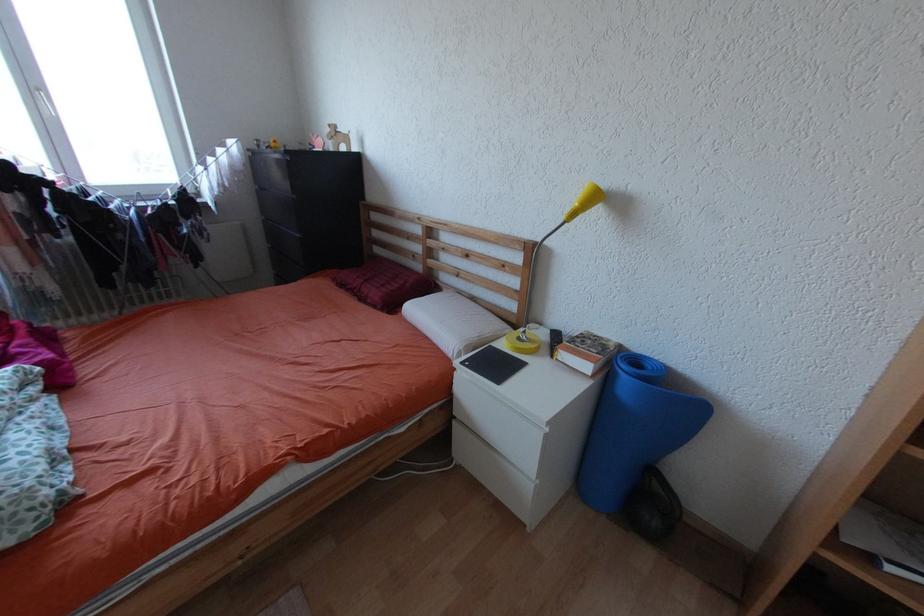
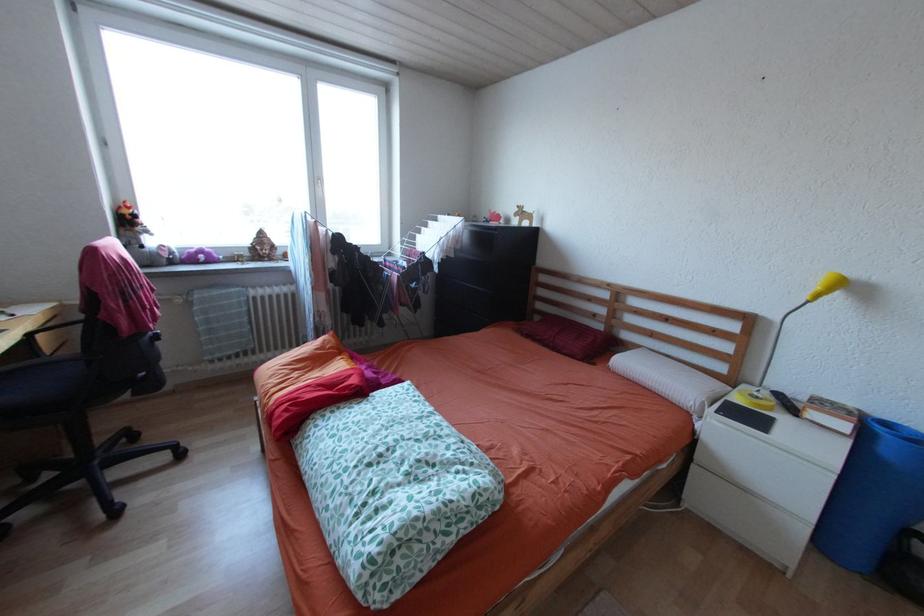
In a continuous first-person perspective shot, in which direction is the camera moving?

The movement direction of the cameraman is left, backward.